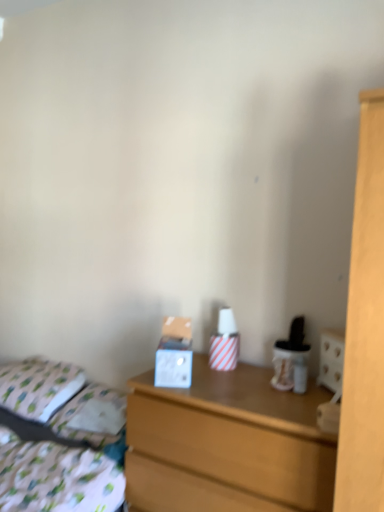
Question: From the image's perspective, is patterned fabric bed at lower left above or below white fabric pillow at left?

Choices:
 (A) above
 (B) below

Answer: (B)

Question: In terms of height, does patterned fabric bed at lower left look taller or shorter compared to white fabric pillow at left?

Choices:
 (A) short
 (B) tall

Answer: (B)

Question: Which of these objects is positioned farthest from the wooden chest of drawers at center?

Choices:
 (A) white fabric pillow at left
 (B) patterned fabric bed at lower left

Answer: (A)

Question: Based on their relative distances, which object is nearer to the wooden chest of drawers at center?

Choices:
 (A) patterned fabric bed at lower left
 (B) white fabric pillow at left

Answer: (A)